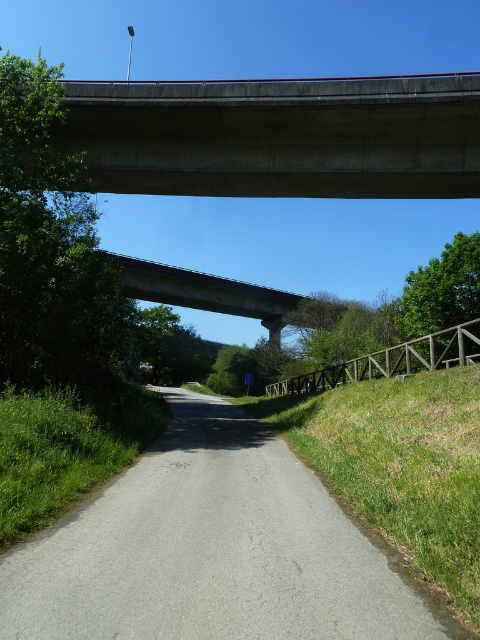
Question: Which point appears closest to the camera in this image?

Choices:
 (A) (195, 481)
 (B) (170, 189)
 (C) (273, 317)
 (D) (478, 614)

Answer: (D)

Question: Is concrete at upper center to the left of concrete bridge at center from the viewer's perspective?

Choices:
 (A) no
 (B) yes

Answer: (A)

Question: Is gray asphalt road at center thinner than green grass at lower right?

Choices:
 (A) yes
 (B) no

Answer: (B)

Question: Observing the image, what is the correct spatial positioning of concrete at upper center in reference to green grass at lower right?

Choices:
 (A) above
 (B) below

Answer: (A)

Question: Considering the real-world distances, which object is farthest from the green grass at lower right?

Choices:
 (A) concrete at upper center
 (B) concrete bridge at center

Answer: (B)

Question: Which point is farther from the camera taking this photo?

Choices:
 (A) [x=243, y=579]
 (B) [x=455, y=420]
 (C) [x=103, y=88]

Answer: (C)